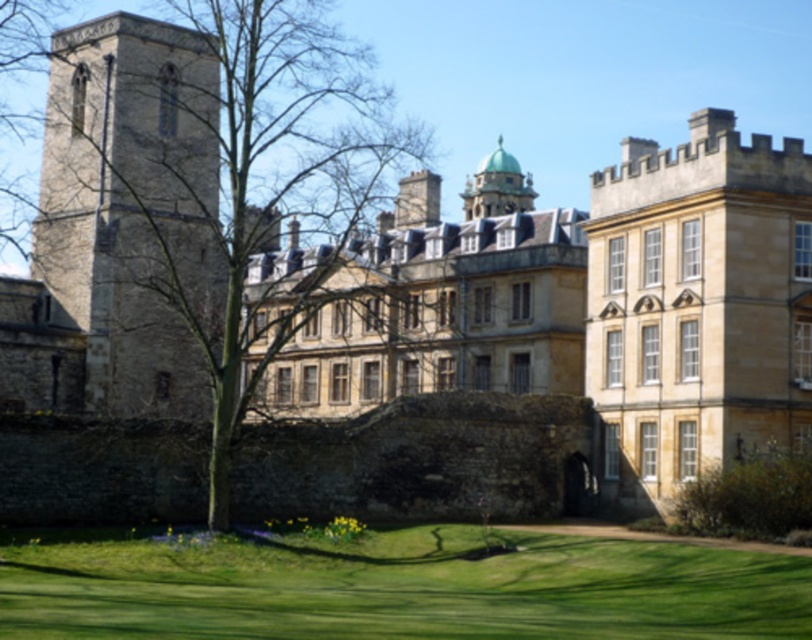
Who is more distant from viewer, (547, 573) or (81, 131)?

The point (81, 131) is more distant.

Does green grass at lower center have a lesser width compared to stone tower at left?

No, green grass at lower center is not thinner than stone tower at left.

Between point (644, 586) and point (149, 252), which one is positioned behind?

Point (149, 252)

In order to click on green grass at lower center in this screenshot , I will do `click(395, 588)`.